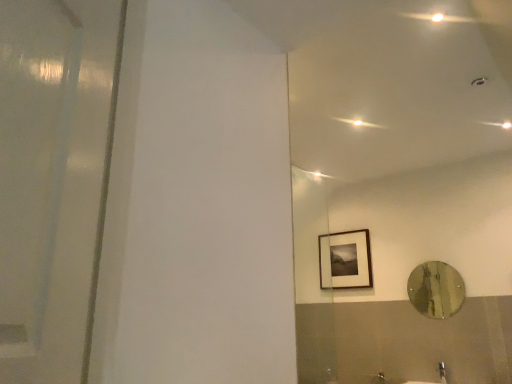
Question: Is matte black picture frame at upper right in front of or behind metallic reflective mirror at right in the image?

Choices:
 (A) behind
 (B) front

Answer: (A)

Question: Is matte black picture frame at upper right wider or thinner than metallic reflective mirror at right?

Choices:
 (A) wide
 (B) thin

Answer: (A)

Question: Which object is the closest to the satin nickel faucet at lower right?

Choices:
 (A) metallic reflective mirror at right
 (B) matte black picture frame at upper right

Answer: (A)

Question: Estimate the real-world distances between objects in this image. Which object is farther from the satin nickel faucet at lower right?

Choices:
 (A) matte black picture frame at upper right
 (B) metallic reflective mirror at right

Answer: (A)